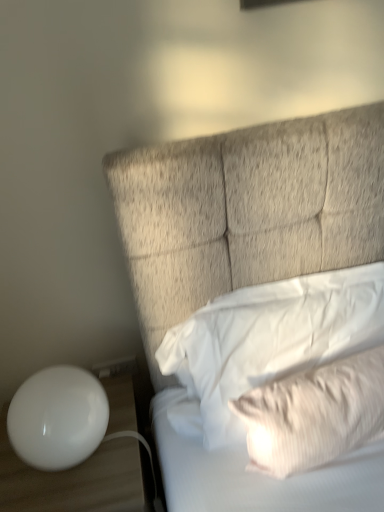
Question: Is point (54, 420) positioned closer to the camera than point (41, 489)?

Choices:
 (A) closer
 (B) farther

Answer: (A)

Question: In the image, is white glossy sphere at lower left positioned in front of or behind white glossy table at lower left?

Choices:
 (A) behind
 (B) front

Answer: (B)

Question: Which object is the closest to the white plastic electric outlet at lower left?

Choices:
 (A) white striped pillow at upper right, marked as the 2th pillow in a top-to-bottom arrangement
 (B) white glossy table at lower left
 (C) white glossy sphere at lower left
 (D) white soft pillow at upper right, the second pillow positioned from the bottom

Answer: (B)

Question: Considering the real-world distances, which object is farthest from the white glossy table at lower left?

Choices:
 (A) white plastic electric outlet at lower left
 (B) white glossy sphere at lower left
 (C) white soft pillow at upper right, the second pillow positioned from the bottom
 (D) white striped pillow at upper right, marked as the 2th pillow in a top-to-bottom arrangement

Answer: (D)